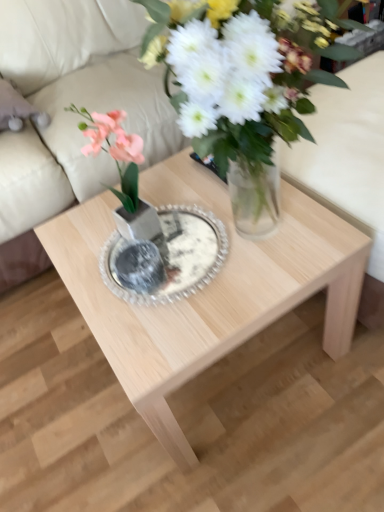
In order to click on vacant space situated on the left part of pink silk flower at center in this screenshot , I will do `click(82, 234)`.